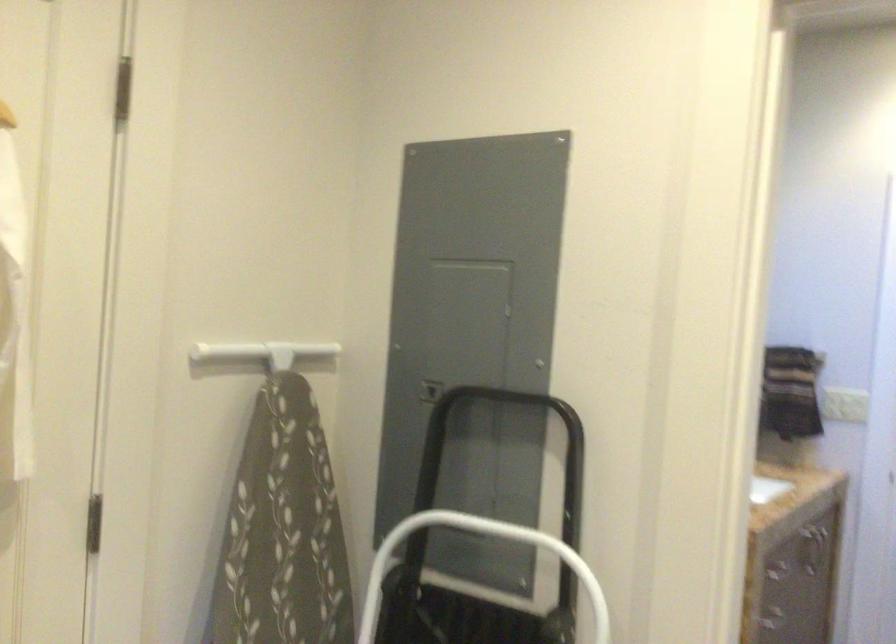
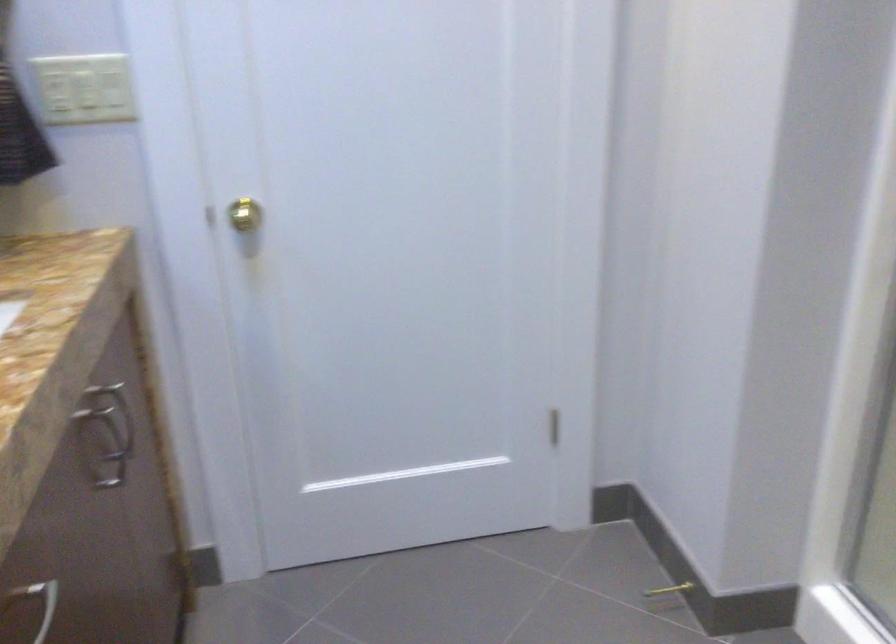
Find the pixel in the second image that matches the point at 815,564 in the first image.

(113, 453)